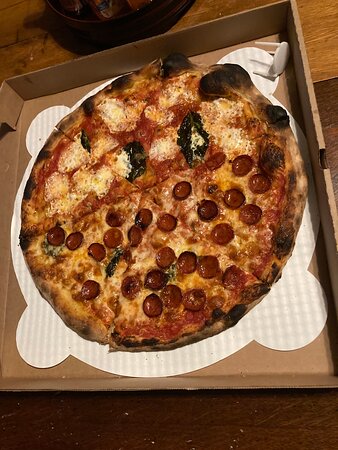
Image resolution: width=338 pixels, height=450 pixels. I want to click on cardboard box, so click(x=266, y=374).